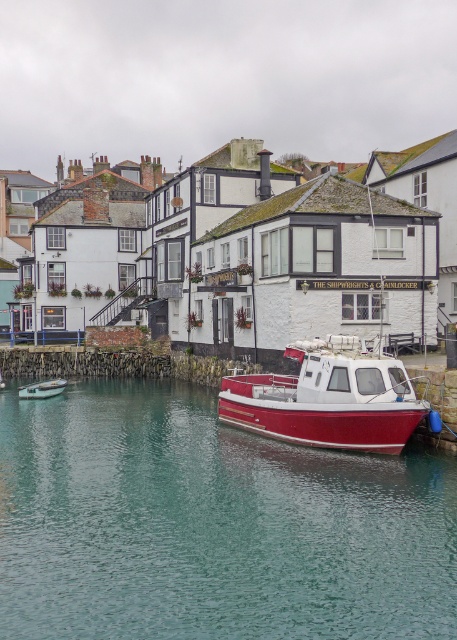
Question: Is teal glossy water at lower center positioned before red matte boat at center?

Choices:
 (A) no
 (B) yes

Answer: (B)

Question: Which object is positioned closest to the teal glossy water at lower center?

Choices:
 (A) red matte boat at center
 (B) metallic silver boat at lower left

Answer: (A)

Question: Is teal glossy water at lower center positioned in front of red matte boat at center?

Choices:
 (A) yes
 (B) no

Answer: (A)

Question: Which of these objects is positioned closest to the metallic silver boat at lower left?

Choices:
 (A) red matte boat at center
 (B) teal glossy water at lower center

Answer: (B)

Question: Does teal glossy water at lower center lie in front of metallic silver boat at lower left?

Choices:
 (A) no
 (B) yes

Answer: (B)

Question: Which point is closer to the camera?

Choices:
 (A) teal glossy water at lower center
 (B) red matte boat at center
 (C) metallic silver boat at lower left

Answer: (A)